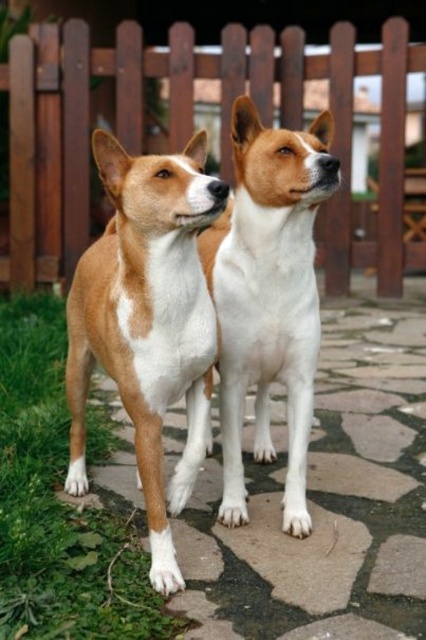
Question: Is brown stone pavement at center to the right of wooden fence at upper center from the viewer's perspective?

Choices:
 (A) no
 (B) yes

Answer: (B)

Question: Can you confirm if wooden fence at upper center is positioned to the right of green grass at lower left?

Choices:
 (A) yes
 (B) no

Answer: (A)

Question: Does brown stone pavement at center have a smaller size compared to green grass at lower left?

Choices:
 (A) yes
 (B) no

Answer: (B)

Question: Estimate the real-world distances between objects in this image. Which object is farther from the wooden fence at upper center?

Choices:
 (A) green grass at lower left
 (B) white fur dog at center

Answer: (B)

Question: Which object is the closest to the brown stone pavement at center?

Choices:
 (A) green grass at lower left
 (B) wooden fence at upper center
 (C) white fur dog at center
 (D) brown/white fur dog at left

Answer: (A)

Question: Which of the following is the farthest from the observer?

Choices:
 (A) (126, 24)
 (B) (75, 548)
 (C) (339, 573)
 (D) (187, 216)

Answer: (A)